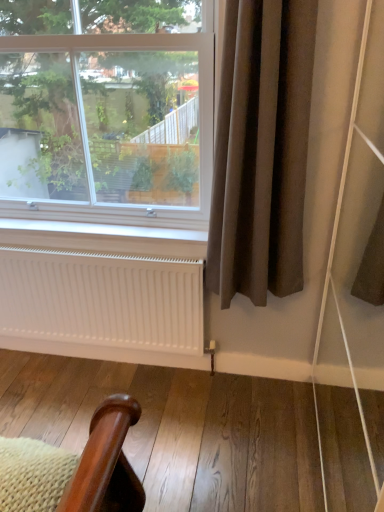
Image resolution: width=384 pixels, height=512 pixels. In order to click on free point in front of white matte radiator at lower center in this screenshot , I will do `click(96, 408)`.